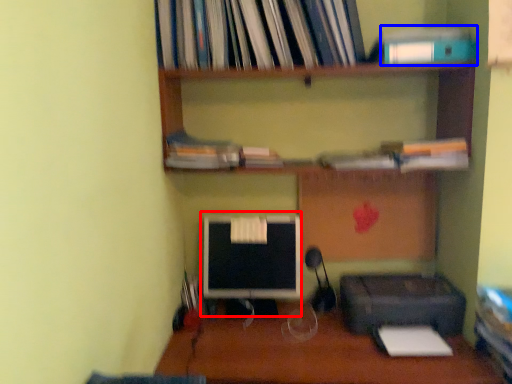
Question: Which object appears farthest to the camera in this image, computer monitor (highlighted by a red box) or paperback book (highlighted by a blue box)?

Choices:
 (A) computer monitor
 (B) paperback book

Answer: (A)